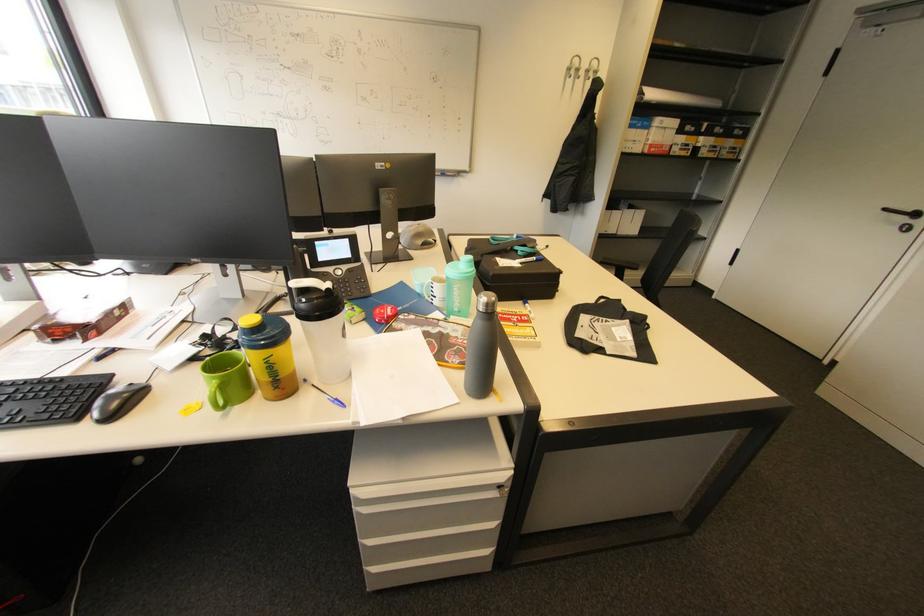
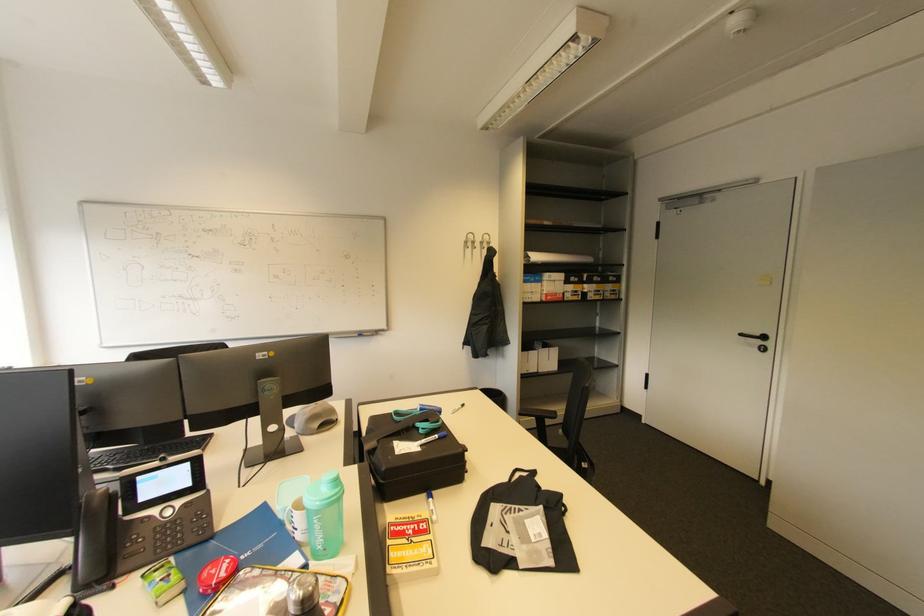
In the second image, find the point that corresponds to (x=592, y=71) in the first image.

(487, 244)